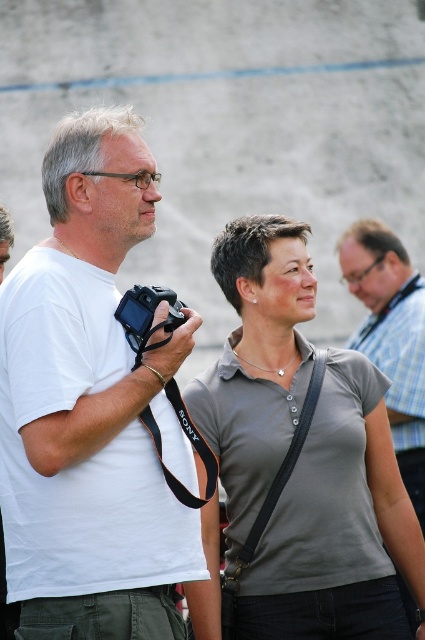
You are a photographer trying to set up two cameras for a photo shoot. You have a white matte camera at left and a black plastic camera at left. If you want to place them side by side, will they fit within a 4.2 meter wide space?

The white matte camera at left and black plastic camera at left are 4.19 meters apart from each other, so yes, they will fit within a 4.2 meter wide space since the distance between them is slightly less than the available space.

You are a photographer trying to set up two cameras for a photo shoot. You have a white matte camera at left and a black plastic camera at left. According to the scene, which camera should you adjust first if you want to start with the one closer to the photographer?

The white matte camera at left is to the left of the black plastic camera at left, so the white matte camera at left is closer to the photographer and should be adjusted first.

You are standing in front of the scene and want to know which of the two points, point (305,250) or point (424,468), is nearer to you. Based on the image, which point is closer?

Point (305,250) is closer to the camera than point (424,468), so it is the nearer one.